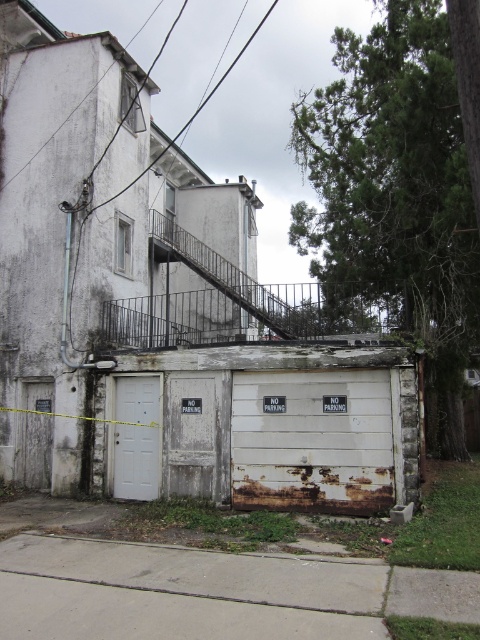
You are standing at point (180, 593). What is the object you are standing on?

The gray concrete sidewalk at lower center is located at point (180, 593), so you are standing on the gray concrete sidewalk at lower center.

You are a delivery person with a cart that is 14 feet wide. You need to move from the gray concrete sidewalk at lower center to the building entrance. Is there enough space between the two to pass through?

The distance between the gray concrete sidewalk at lower center and the building entrance is 14.10 feet, which is slightly wider than the cart. Therefore, the cart can pass through comfortably.